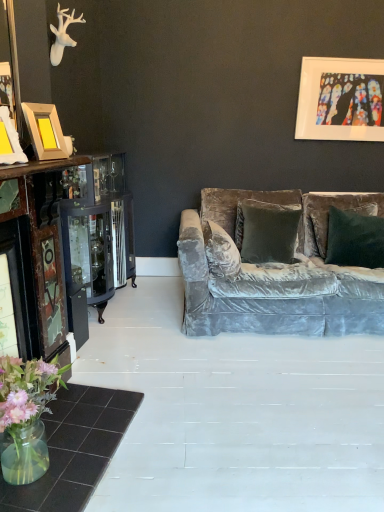
In order to click on stained glass artwork at upper right, positioned as the first picture frame in top-to-bottom order in this screenshot , I will do `click(341, 99)`.

Locate an element on the screen. translucent glass vase at lower left is located at coordinates (75, 448).

Identify the location of translucent glass vase at lower left. (26, 416).

Find the location of a particular element. The width and height of the screenshot is (384, 512). the 1st picture frame behind the translucent glass vase at lower left, starting your count from the anchor is located at coordinates click(45, 131).

In the scene shown: Between translucent glass vase at lower left and wooden photo frame at left, which is the second picture frame from back to front, which one has larger width?

translucent glass vase at lower left is wider.

Could you tell me if translucent glass vase at lower left is facing wooden photo frame at left, the 1th picture frame in the bottom-to-top sequence?

No, translucent glass vase at lower left is not oriented towards wooden photo frame at left, the 1th picture frame in the bottom-to-top sequence.

Is velvet green pillow at center located within translucent glass vase at lower left?

No, velvet green pillow at center is located outside of translucent glass vase at lower left.

Looking at the image, does translucent glass vase at lower left seem bigger or smaller compared to velvet green pillow at center?

Clearly, translucent glass vase at lower left is smaller in size than velvet green pillow at center.

From the image's perspective, relative to velvet green pillow at center, is translucent glass vase at lower left above or below?

translucent glass vase at lower left is below velvet green pillow at center.

How distant is translucent glass vase at lower left from velvet green pillow at center?

translucent glass vase at lower left is 6.67 feet away from velvet green pillow at center.

Which object is wider, stained glass artwork at upper right, the 2th picture frame in the front-to-back sequence, or wooden photo frame at left, arranged as the 1th picture frame when viewed from the front?

wooden photo frame at left, arranged as the 1th picture frame when viewed from the front, is wider.

Does stained glass artwork at upper right, which ranks as the 2th picture frame in bottom-to-top order, have a lesser height compared to wooden photo frame at left, arranged as the 1th picture frame when viewed from the front?

No, stained glass artwork at upper right, which ranks as the 2th picture frame in bottom-to-top order, is not shorter than wooden photo frame at left, arranged as the 1th picture frame when viewed from the front.

There is a wooden photo frame at left, arranged as the 1th picture frame when viewed from the front. At what (x,y) coordinates should I click in order to perform the action: click on picture frame above it (from a real-world perspective). Please return your answer as a coordinate pair (x, y). Looking at the image, I should click on (341, 99).

Considering the positions of objects stained glass artwork at upper right, which is the first picture frame in back-to-front order, and wooden photo frame at left, which is the second picture frame from back to front, in the image provided, who is in front, stained glass artwork at upper right, which is the first picture frame in back-to-front order, or wooden photo frame at left, which is the second picture frame from back to front,?

wooden photo frame at left, which is the second picture frame from back to front.

Measure the distance from wooden photo frame at left, arranged as the 1th picture frame when viewed from the front, to translucent glass vase at lower left.

wooden photo frame at left, arranged as the 1th picture frame when viewed from the front, is 1.25 meters from translucent glass vase at lower left.

Considering the relative sizes of wooden photo frame at left, which is the first picture frame in left-to-right order, and translucent glass vase at lower left in the image provided, is wooden photo frame at left, which is the first picture frame in left-to-right order, smaller than translucent glass vase at lower left?

Indeed, wooden photo frame at left, which is the first picture frame in left-to-right order, has a smaller size compared to translucent glass vase at lower left.

From the image's perspective, is wooden photo frame at left, the 1th picture frame in the bottom-to-top sequence, above translucent glass vase at lower left?

Indeed, from the image's perspective, wooden photo frame at left, the 1th picture frame in the bottom-to-top sequence, is shown above translucent glass vase at lower left.

Considering the relative positions of wooden photo frame at left, which is the first picture frame in left-to-right order, and translucent glass vase at lower left in the image provided, is wooden photo frame at left, which is the first picture frame in left-to-right order, to the left of translucent glass vase at lower left from the viewer's perspective?

Yes.

Find the location of `pillow behind the translucent glass vase at lower left`. pillow behind the translucent glass vase at lower left is located at coordinates (354, 239).

Does velvet green pillow at center contain translucent glass vase at lower left?

Definitely not — translucent glass vase at lower left is not inside velvet green pillow at center.

Consider the image. From the image's perspective, which is above, velvet green pillow at center or translucent glass vase at lower left?

velvet green pillow at center appears higher in the image.

Based on their positions, is stained glass artwork at upper right, the 1th picture frame in the right-to-left sequence, located to the left or right of translucent glass vase at lower left?

From the image, it's evident that stained glass artwork at upper right, the 1th picture frame in the right-to-left sequence, is to the right of translucent glass vase at lower left.

What's the angular difference between stained glass artwork at upper right, positioned as the first picture frame in top-to-bottom order, and translucent glass vase at lower left's facing directions?

The facing directions of stained glass artwork at upper right, positioned as the first picture frame in top-to-bottom order, and translucent glass vase at lower left are 77.9 degrees apart.

From a real-world perspective, between stained glass artwork at upper right, positioned as the first picture frame in top-to-bottom order, and translucent glass vase at lower left, who is vertically higher?

From a 3D spatial view, stained glass artwork at upper right, positioned as the first picture frame in top-to-bottom order, is above.

Choose the correct answer: Is stained glass artwork at upper right, which is the second picture frame in left-to-right order, inside translucent glass vase at lower left or outside it?

stained glass artwork at upper right, which is the second picture frame in left-to-right order, lies outside translucent glass vase at lower left.

Who is more distant, stained glass artwork at upper right, positioned as the first picture frame in top-to-bottom order, or translucent glass vase at lower left?

stained glass artwork at upper right, positioned as the first picture frame in top-to-bottom order, is further from the camera.

This screenshot has width=384, height=512. I want to click on picture frame that is the 2nd one when counting upward from the translucent glass vase at lower left (from the image's perspective), so click(x=341, y=99).

From a real-world perspective, between stained glass artwork at upper right, which ranks as the 2th picture frame in bottom-to-top order, and translucent glass vase at lower left, who is vertically higher?

From a 3D spatial view, stained glass artwork at upper right, which ranks as the 2th picture frame in bottom-to-top order, is above.

Find the location of `picture frame on the left of translucent glass vase at lower left`. picture frame on the left of translucent glass vase at lower left is located at coordinates (45, 131).

Locate an element on the screen. Image resolution: width=384 pixels, height=512 pixels. pillow on the right side of translucent glass vase at lower left is located at coordinates (354, 239).

Which object lies further to the anchor point translucent glass vase at lower left, translucent glass vase at lower left or stained glass artwork at upper right, which is the first picture frame in back-to-front order?

stained glass artwork at upper right, which is the first picture frame in back-to-front order.

Considering their positions, is translucent glass vase at lower left positioned closer to velvet green pillow at center than wooden photo frame at left, which is the second picture frame from back to front?

Among the two, wooden photo frame at left, which is the second picture frame from back to front, is located nearer to velvet green pillow at center.

In the scene shown: Which object lies nearer to the anchor point velvet green pillow at center, translucent glass vase at lower left or translucent glass vase at lower left?

translucent glass vase at lower left is positioned closer to the anchor velvet green pillow at center.

From the image, which object appears to be nearer to translucent glass vase at lower left, stained glass artwork at upper right, which is the first picture frame in back-to-front order, or translucent glass vase at lower left?

The object closer to translucent glass vase at lower left is translucent glass vase at lower left.

Based on their spatial positions, is velvet green pillow at center or translucent glass vase at lower left further from wooden photo frame at left, the 1th picture frame in the bottom-to-top sequence?

velvet green pillow at center is positioned further to the anchor wooden photo frame at left, the 1th picture frame in the bottom-to-top sequence.

Estimate the real-world distances between objects in this image. Which object is closer to stained glass artwork at upper right, which ranks as the 2th picture frame in bottom-to-top order, velvet green pillow at center or translucent glass vase at lower left?

The object closer to stained glass artwork at upper right, which ranks as the 2th picture frame in bottom-to-top order, is velvet green pillow at center.

Based on their spatial positions, is translucent glass vase at lower left or velvet green pillow at center further from stained glass artwork at upper right, positioned as the first picture frame in top-to-bottom order?

The object further to stained glass artwork at upper right, positioned as the first picture frame in top-to-bottom order, is translucent glass vase at lower left.

Looking at the image, which one is located closer to stained glass artwork at upper right, which ranks as the 2th picture frame in bottom-to-top order, wooden photo frame at left, the second picture frame from the right, or velvet green pillow at center?

Based on the image, velvet green pillow at center appears to be nearer to stained glass artwork at upper right, which ranks as the 2th picture frame in bottom-to-top order.

The width and height of the screenshot is (384, 512). Find the location of `picture frame between translucent glass vase at lower left and velvet green pillow at center in the horizontal direction`. picture frame between translucent glass vase at lower left and velvet green pillow at center in the horizontal direction is located at coordinates (45, 131).

Identify the location of table between wooden photo frame at left, which is the second picture frame from back to front, and velvet green pillow at center from left to right. This screenshot has height=512, width=384. (75, 448).

Locate an element on the screen. floral arrangement between stained glass artwork at upper right, which is the second picture frame in left-to-right order, and translucent glass vase at lower left in the up-down direction is located at coordinates (26, 416).

What are the coordinates of `floral arrangement between wooden photo frame at left, which ranks as the second picture frame in top-to-bottom order, and translucent glass vase at lower left from top to bottom` in the screenshot? It's located at (26, 416).